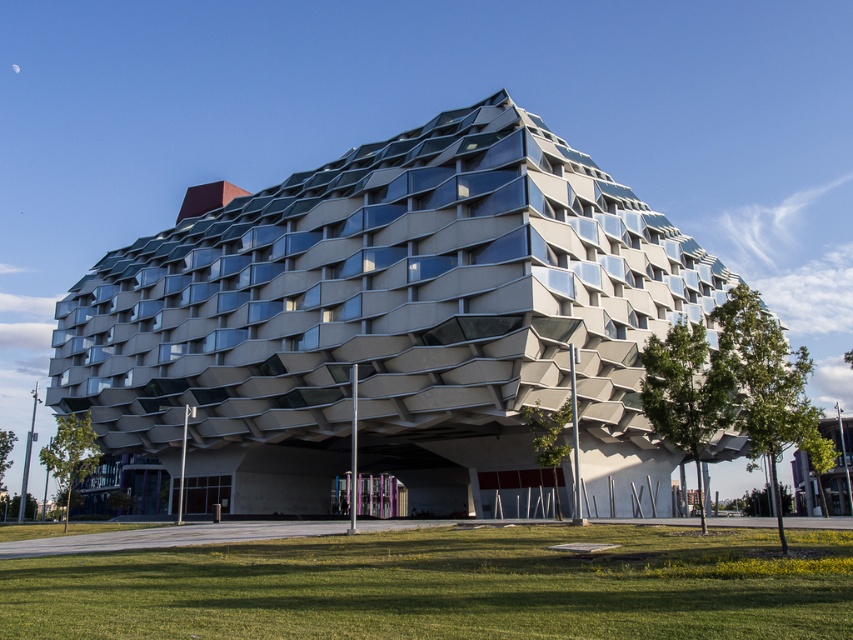
Question: Is textured concrete building at center thinner than green grass at lower center?

Choices:
 (A) yes
 (B) no

Answer: (B)

Question: Among these objects, which one is nearest to the camera?

Choices:
 (A) green grass at lower center
 (B) textured concrete building at center

Answer: (A)

Question: Which of the following is the closest to the observer?

Choices:
 (A) textured concrete building at center
 (B) green grass at lower center

Answer: (B)

Question: Does textured concrete building at center appear on the left side of green grass at lower center?

Choices:
 (A) no
 (B) yes

Answer: (B)

Question: Can you confirm if textured concrete building at center is positioned below green grass at lower center?

Choices:
 (A) no
 (B) yes

Answer: (B)